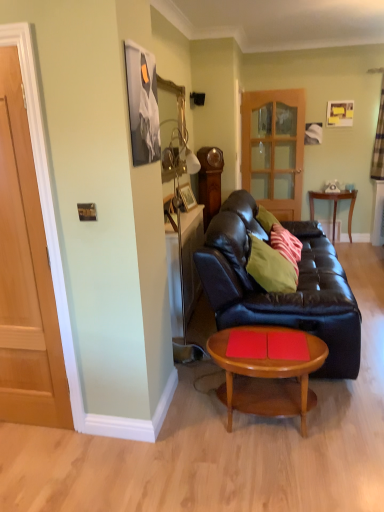
Question: Can you confirm if wooden side table at right is shorter than translucent wooden door at center?

Choices:
 (A) no
 (B) yes

Answer: (B)

Question: From a real-world perspective, is wooden side table at right physically below translucent wooden door at center?

Choices:
 (A) no
 (B) yes

Answer: (B)

Question: From a real-world perspective, is wooden side table at right over translucent wooden door at center?

Choices:
 (A) yes
 (B) no

Answer: (B)

Question: From the image's perspective, does wooden side table at right appear higher than translucent wooden door at center?

Choices:
 (A) yes
 (B) no

Answer: (B)

Question: Is wooden side table at right taller than translucent wooden door at center?

Choices:
 (A) no
 (B) yes

Answer: (A)

Question: Is translucent wooden door at center wider or thinner than white sheer curtain at upper right?

Choices:
 (A) thin
 (B) wide

Answer: (A)

Question: From a real-world perspective, relative to white sheer curtain at upper right, is translucent wooden door at center vertically above or below?

Choices:
 (A) above
 (B) below

Answer: (B)

Question: From their relative heights in the image, would you say translucent wooden door at center is taller or shorter than white sheer curtain at upper right?

Choices:
 (A) short
 (B) tall

Answer: (B)

Question: Considering the positions of point (291, 187) and point (382, 68), is point (291, 187) closer or farther from the camera than point (382, 68)?

Choices:
 (A) farther
 (B) closer

Answer: (A)

Question: Which is correct: light brown wooden coffee table at center is inside white sheer curtain at upper right, or outside of it?

Choices:
 (A) outside
 (B) inside

Answer: (A)

Question: In terms of width, does light brown wooden coffee table at center look wider or thinner when compared to white sheer curtain at upper right?

Choices:
 (A) wide
 (B) thin

Answer: (A)

Question: From a real-world perspective, relative to white sheer curtain at upper right, is light brown wooden coffee table at center vertically above or below?

Choices:
 (A) below
 (B) above

Answer: (A)

Question: Considering the relative positions of light brown wooden coffee table at center and white sheer curtain at upper right in the image provided, is light brown wooden coffee table at center to the left or to the right of white sheer curtain at upper right?

Choices:
 (A) left
 (B) right

Answer: (A)

Question: From the image's perspective, is green matte pillow at center, which ranks as the second pillow in front-to-back order, located above or below translucent wooden door at center?

Choices:
 (A) below
 (B) above

Answer: (A)

Question: Considering the positions of green matte pillow at center, which is counted as the 1th pillow, starting from the back, and translucent wooden door at center in the image, is green matte pillow at center, which is counted as the 1th pillow, starting from the back, taller or shorter than translucent wooden door at center?

Choices:
 (A) short
 (B) tall

Answer: (A)